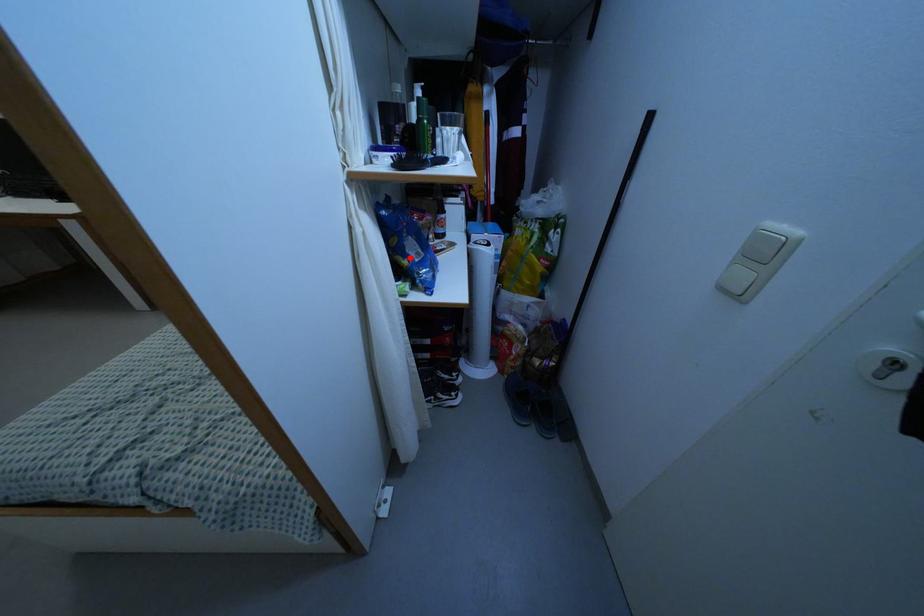
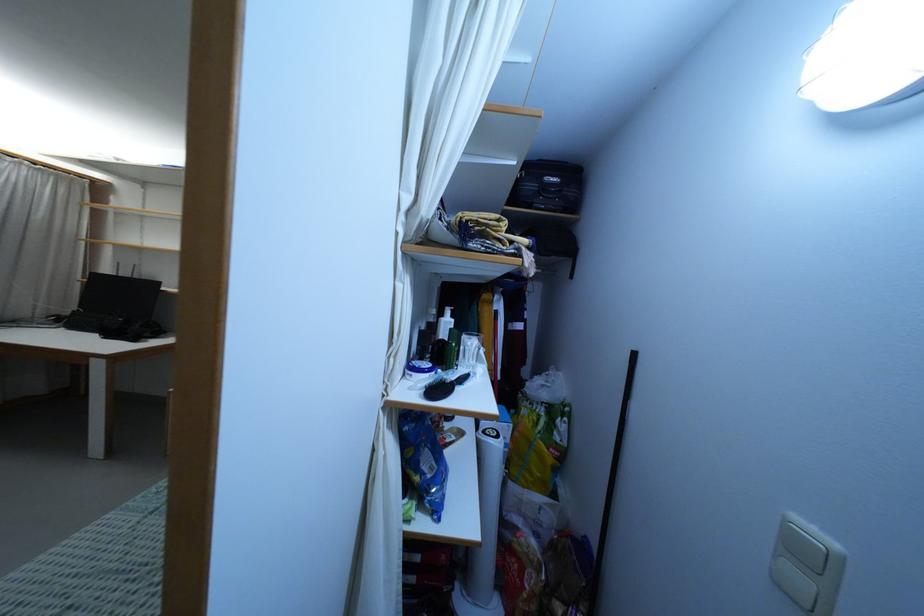
Question: A red point is marked in image1. In image2, is the corresponding 3D point closer to the camera or farther? Reply with the corresponding letter.

Choices:
 (A) The corresponding 3D point is closer.
 (B) The corresponding 3D point is farther.

Answer: (B)